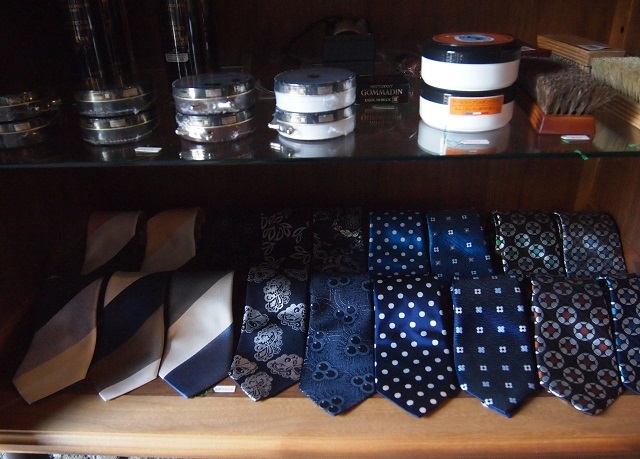
Where is `brown box`? brown box is located at coordinates (553, 122).